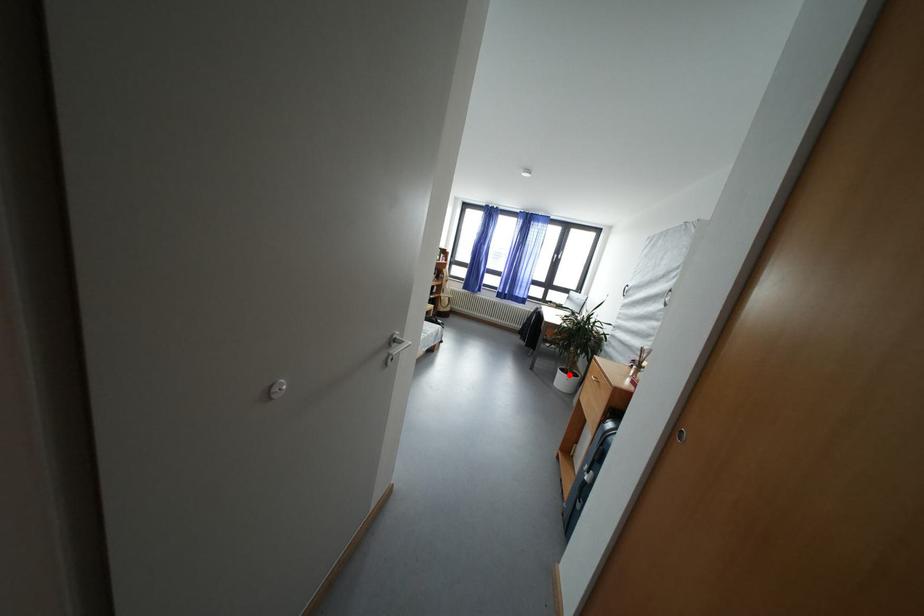
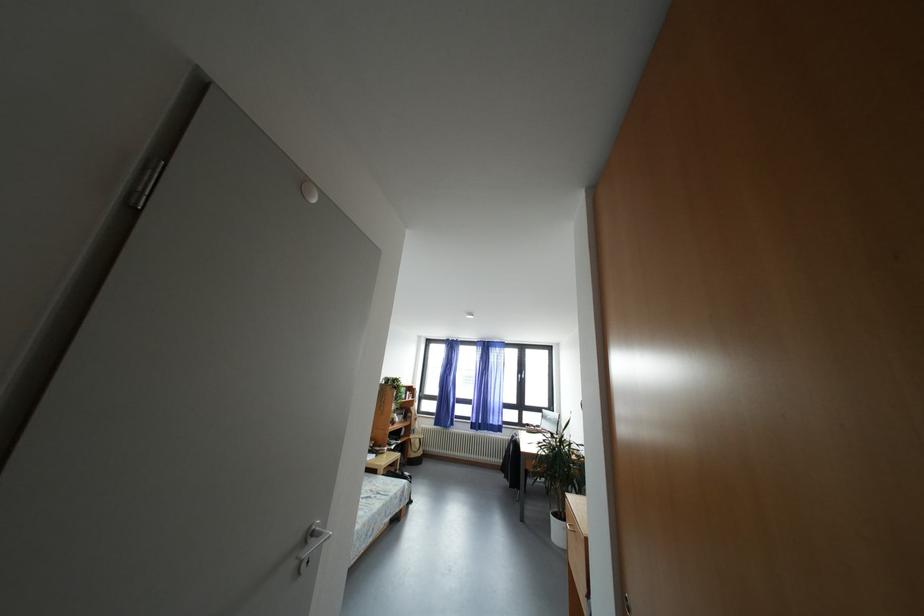
Question: I am providing you with two images of the same scene from different viewpoints. A red point is shown in image1. For the corresponding object point in image2, is it positioned nearer or farther from the camera?

Choices:
 (A) Nearer
 (B) Farther

Answer: (B)